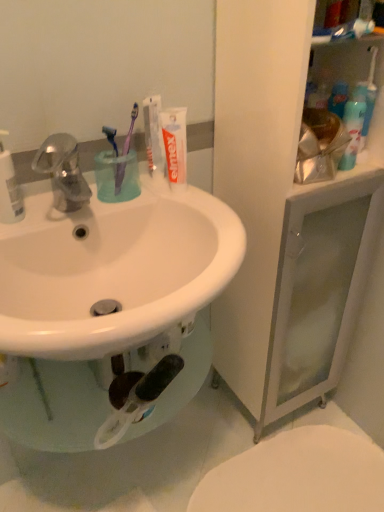
What do you see at coordinates (353, 128) in the screenshot? The width and height of the screenshot is (384, 512). I see `translucent plastic spray bottle at upper right, which is counted as the 2th cleaning product, starting from the left` at bounding box center [353, 128].

This screenshot has height=512, width=384. What do you see at coordinates (175, 145) in the screenshot? I see `white matte toothpaste at upper center, placed as the 1th toothpaste when sorted from right to left` at bounding box center [175, 145].

The width and height of the screenshot is (384, 512). What do you see at coordinates (130, 129) in the screenshot?
I see `purple plastic toothbrush at upper center, the 1th toothbrush positioned from the right` at bounding box center [130, 129].

What do you see at coordinates (9, 190) in the screenshot? I see `white plastic bottle at left, the 1th cleaning product in the front-to-back sequence` at bounding box center [9, 190].

In order to face white matte toothpaste at upper center, positioned as the second toothpaste in right-to-left order, should I rotate leftwards or rightwards?

To align with it, rotate left about 5.174°.

Find the location of a particular element. Image resolution: width=384 pixels, height=512 pixels. translucent plastic spray bottle at upper right, which is counted as the 2th cleaning product, starting from the left is located at coordinates (353, 128).

Looking at their sizes, would you say white glossy toilet at lower right is wider or thinner than purple plastic toothbrush at upper center, the 1th toothbrush positioned from the right?

white glossy toilet at lower right is wider than purple plastic toothbrush at upper center, the 1th toothbrush positioned from the right.

Could you measure the distance between white glossy toilet at lower right and purple plastic toothbrush at upper center, the 1th toothbrush positioned from the right?

96.30 centimeters.

The width and height of the screenshot is (384, 512). Find the location of `toilet lying below the purple plastic toothbrush at upper center, which is the 2th toothbrush in left-to-right order (from the image's perspective)`. toilet lying below the purple plastic toothbrush at upper center, which is the 2th toothbrush in left-to-right order (from the image's perspective) is located at coordinates (297, 475).

Considering the points (373, 500) and (131, 125), which point is in front, point (373, 500) or point (131, 125)?

The point (131, 125) is closer.

Between white plastic bottle at left, the 2th cleaning product in the back-to-front sequence, and white matte toothpaste at upper center, placed as the 1th toothpaste when sorted from right to left, which one has larger width?

With larger width is white plastic bottle at left, the 2th cleaning product in the back-to-front sequence.

From a real-world perspective, is white plastic bottle at left, positioned as the second cleaning product in right-to-left order, beneath white matte toothpaste at upper center, placed as the 1th toothpaste when sorted from right to left?

Yes, from a real-world perspective, white plastic bottle at left, positioned as the second cleaning product in right-to-left order, is below white matte toothpaste at upper center, placed as the 1th toothpaste when sorted from right to left.

Could you tell me if white plastic bottle at left, the 2th cleaning product in the back-to-front sequence, is turned towards white matte toothpaste at upper center, the 2th toothpaste in the left-to-right sequence?

No.

Measure the distance from white plastic bottle at left, positioned as the second cleaning product in right-to-left order, to white matte toothpaste at upper center, the 2th toothpaste in the left-to-right sequence.

They are 12.14 inches apart.

Is point (184, 184) positioned before point (353, 165)?

Yes, it is.

Is white matte toothpaste at upper center, placed as the 1th toothpaste when sorted from right to left, thinner than translucent plastic spray bottle at upper right, marked as the 1th cleaning product in a back-to-front arrangement?

No.

From the image's perspective, is white matte toothpaste at upper center, placed as the 1th toothpaste when sorted from right to left, below translucent plastic spray bottle at upper right, which is counted as the 2th cleaning product, starting from the left?

Yes.

Is white matte toothpaste at upper center, placed as the 1th toothpaste when sorted from right to left, smaller than translucent plastic spray bottle at upper right, which is counted as the 2th cleaning product, starting from the left?

Correct, white matte toothpaste at upper center, placed as the 1th toothpaste when sorted from right to left, occupies less space than translucent plastic spray bottle at upper right, which is counted as the 2th cleaning product, starting from the left.

From a real-world perspective, who is located higher, purple plastic toothbrush at upper center, which ranks as the second toothbrush in right-to-left order, or white plastic bottle at left, positioned as the second cleaning product in right-to-left order?

In real-world perspective, white plastic bottle at left, positioned as the second cleaning product in right-to-left order, is above.

Is purple plastic toothbrush at upper center, placed as the first toothbrush when sorted from left to right, completely or partially outside of white plastic bottle at left, positioned as the second cleaning product in right-to-left order?

Yes, purple plastic toothbrush at upper center, placed as the first toothbrush when sorted from left to right, is located beyond the bounds of white plastic bottle at left, positioned as the second cleaning product in right-to-left order.

Does point (119, 192) lie behind point (18, 217)?

Yes, point (119, 192) is farther from viewer.

Between purple plastic toothbrush at upper center, placed as the first toothbrush when sorted from left to right, and white plastic bottle at left, the 1th cleaning product in the front-to-back sequence, which one has smaller size?

purple plastic toothbrush at upper center, placed as the first toothbrush when sorted from left to right, is smaller.

Which object is thinner, purple plastic toothbrush at upper center, which is the 2th toothbrush in left-to-right order, or white glossy toilet at lower right?

purple plastic toothbrush at upper center, which is the 2th toothbrush in left-to-right order, is thinner.

Who is bigger, purple plastic toothbrush at upper center, which is the 2th toothbrush in left-to-right order, or white glossy toilet at lower right?

white glossy toilet at lower right.

Is purple plastic toothbrush at upper center, which is the 2th toothbrush in left-to-right order, positioned beyond the bounds of white glossy toilet at lower right?

purple plastic toothbrush at upper center, which is the 2th toothbrush in left-to-right order, lies outside white glossy toilet at lower right's area.

Considering the relative positions of white plastic bottle at left, the 2th cleaning product in the back-to-front sequence, and purple plastic toothbrush at upper center, the 1th toothbrush positioned from the right, in the image provided, is white plastic bottle at left, the 2th cleaning product in the back-to-front sequence, to the left or to the right of purple plastic toothbrush at upper center, the 1th toothbrush positioned from the right,?

Clearly, white plastic bottle at left, the 2th cleaning product in the back-to-front sequence, is on the left of purple plastic toothbrush at upper center, the 1th toothbrush positioned from the right, in the image.

Which object is more forward, white plastic bottle at left, the 2th cleaning product in the back-to-front sequence, or purple plastic toothbrush at upper center, which is the 2th toothbrush in left-to-right order?

Positioned in front is white plastic bottle at left, the 2th cleaning product in the back-to-front sequence.

Considering the points (5, 186) and (122, 177), which point is in front, point (5, 186) or point (122, 177)?

The point (5, 186) is closer.

From a real-world perspective, which object stands above the other?

In real-world perspective, purple plastic toothbrush at upper center, the 1th toothbrush positioned from the right, is above.

What are the coordinates of `toilet below the white matte toothpaste at upper center, which appears as the first toothpaste when viewed from the left (from a real-world perspective)` in the screenshot? It's located at (297, 475).

Can you confirm if white glossy toilet at lower right is wider than white matte toothpaste at upper center, which appears as the first toothpaste when viewed from the left?

Yes, white glossy toilet at lower right is wider than white matte toothpaste at upper center, which appears as the first toothpaste when viewed from the left.

How different are the orientations of white glossy toilet at lower right and white matte toothpaste at upper center, which appears as the first toothpaste when viewed from the left, in degrees?

The angle between the facing direction of white glossy toilet at lower right and the facing direction of white matte toothpaste at upper center, which appears as the first toothpaste when viewed from the left, is 1.52 degrees.

Visually, is white glossy toilet at lower right positioned to the left or to the right of white matte toothpaste at upper center, which appears as the first toothpaste when viewed from the left?

white glossy toilet at lower right is positioned on white matte toothpaste at upper center, which appears as the first toothpaste when viewed from the left,'s right side.

At what (x,y) coordinates should I click in order to perform the action: click on the 2nd toothbrush in front of the white glossy toilet at lower right. Please return your answer as a coordinate pair (x, y). The width and height of the screenshot is (384, 512). Looking at the image, I should click on (130, 129).

Identify the location of cleaning product that appears below the white matte toothpaste at upper center, the 2th toothpaste in the left-to-right sequence (from a real-world perspective). (9, 190).

From the image, which object appears to be farther from translucent plastic spray bottle at upper right, which is the 1th cleaning product from right to left, white matte toothpaste at upper center, placed as the 1th toothpaste when sorted from right to left, or purple plastic toothbrush at upper center, placed as the first toothbrush when sorted from left to right?

purple plastic toothbrush at upper center, placed as the first toothbrush when sorted from left to right, is positioned further to the anchor translucent plastic spray bottle at upper right, which is the 1th cleaning product from right to left.

Considering their positions, is matte silver faucet at upper left positioned closer to purple plastic toothbrush at upper center, which is the 2th toothbrush in left-to-right order, than purple plastic toothbrush at upper center, placed as the first toothbrush when sorted from left to right?

purple plastic toothbrush at upper center, placed as the first toothbrush when sorted from left to right.

From the image, which object appears to be nearer to matte silver faucet at upper left, white plastic bottle at left, the 1th cleaning product in the front-to-back sequence, or purple plastic toothbrush at upper center, which is the 2th toothbrush in left-to-right order?

white plastic bottle at left, the 1th cleaning product in the front-to-back sequence.

In the scene shown: Which object lies nearer to the anchor point purple plastic toothbrush at upper center, the 1th toothbrush positioned from the right, matte silver faucet at upper left or translucent plastic spray bottle at upper right, the second cleaning product when ordered from front to back?

matte silver faucet at upper left is closer to purple plastic toothbrush at upper center, the 1th toothbrush positioned from the right.

Looking at the image, which one is located closer to white plastic bottle at left, the first cleaning product positioned from the left, white matte toothpaste at upper center, positioned as the second toothpaste in right-to-left order, or purple plastic toothbrush at upper center, which ranks as the second toothbrush in right-to-left order?

The object closer to white plastic bottle at left, the first cleaning product positioned from the left, is purple plastic toothbrush at upper center, which ranks as the second toothbrush in right-to-left order.

From the image, which object appears to be farther from matte silver faucet at upper left, purple plastic toothbrush at upper center, which ranks as the second toothbrush in right-to-left order, or purple plastic toothbrush at upper center, the 1th toothbrush positioned from the right?

purple plastic toothbrush at upper center, the 1th toothbrush positioned from the right, is further to matte silver faucet at upper left.

When comparing their distances from purple plastic toothbrush at upper center, which ranks as the second toothbrush in right-to-left order, does white matte toothpaste at upper center, positioned as the second toothpaste in right-to-left order, or translucent plastic spray bottle at upper right, which is counted as the 2th cleaning product, starting from the left, seem further?

translucent plastic spray bottle at upper right, which is counted as the 2th cleaning product, starting from the left, lies further to purple plastic toothbrush at upper center, which ranks as the second toothbrush in right-to-left order, than the other object.

From the image, which object appears to be nearer to purple plastic toothbrush at upper center, placed as the first toothbrush when sorted from left to right, purple plastic toothbrush at upper center, the 1th toothbrush positioned from the right, or white matte toothpaste at upper center, placed as the 1th toothpaste when sorted from right to left?

Based on the image, purple plastic toothbrush at upper center, the 1th toothbrush positioned from the right, appears to be nearer to purple plastic toothbrush at upper center, placed as the first toothbrush when sorted from left to right.

The image size is (384, 512). Find the location of `cleaning product between white matte toothpaste at upper center, placed as the 1th toothpaste when sorted from right to left, and white glossy toilet at lower right, in the vertical direction`. cleaning product between white matte toothpaste at upper center, placed as the 1th toothpaste when sorted from right to left, and white glossy toilet at lower right, in the vertical direction is located at coordinates (9, 190).

Find the location of a particular element. The image size is (384, 512). toothbrush between white matte toothpaste at upper center, the 2th toothpaste in the left-to-right sequence, and white glossy toilet at lower right in the up-down direction is located at coordinates (119, 177).

Where is `toothpaste between purple plastic toothbrush at upper center, placed as the first toothbrush when sorted from left to right, and white matte toothpaste at upper center, placed as the 1th toothpaste when sorted from right to left, in the horizontal direction`? Image resolution: width=384 pixels, height=512 pixels. toothpaste between purple plastic toothbrush at upper center, placed as the first toothbrush when sorted from left to right, and white matte toothpaste at upper center, placed as the 1th toothpaste when sorted from right to left, in the horizontal direction is located at coordinates (153, 133).

Locate an element on the screen. Image resolution: width=384 pixels, height=512 pixels. toothpaste between purple plastic toothbrush at upper center, which is the 2th toothbrush in left-to-right order, and white glossy toilet at lower right in the up-down direction is located at coordinates (175, 145).